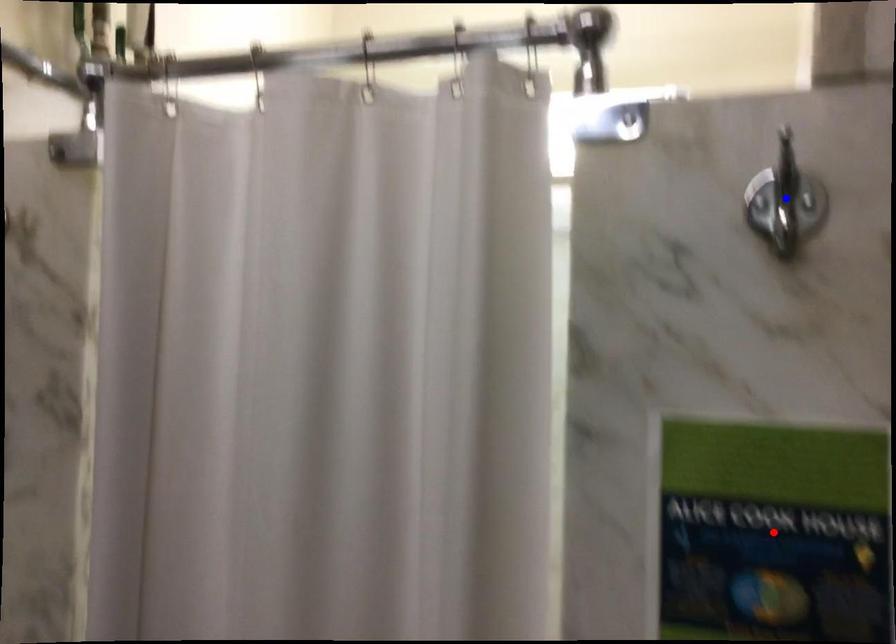
Question: In the image, two points are highlighted. Which point is nearer to the camera? Reply with the corresponding letter.

Choices:
 (A) blue point
 (B) red point

Answer: (A)